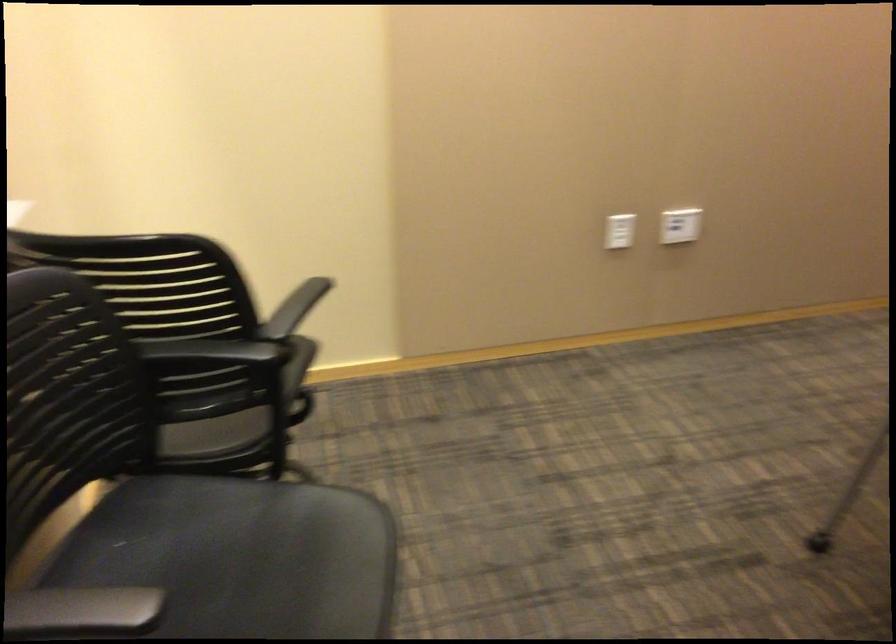
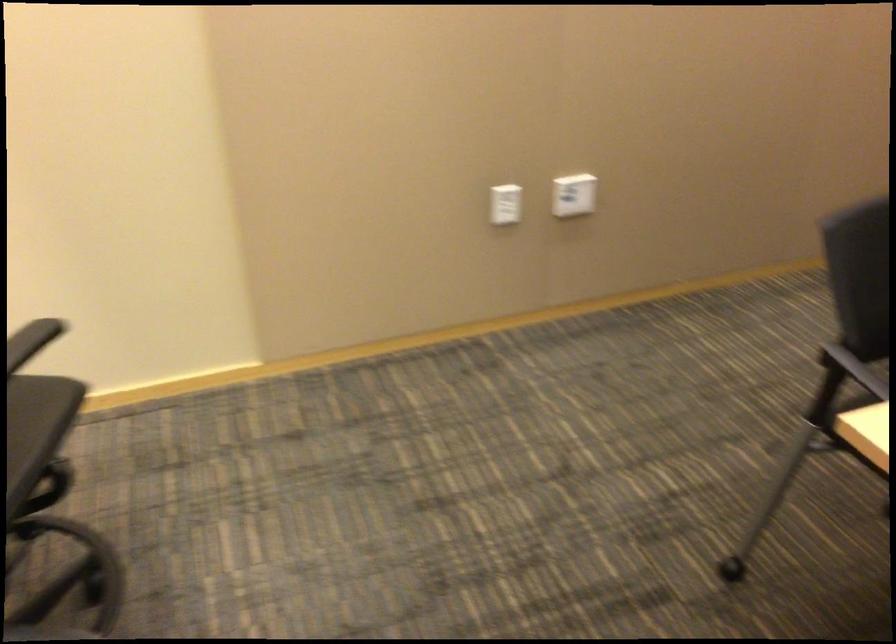
In a continuous first-person perspective shot, in which direction is the camera moving?

The movement direction of the cameraman is right, forward.